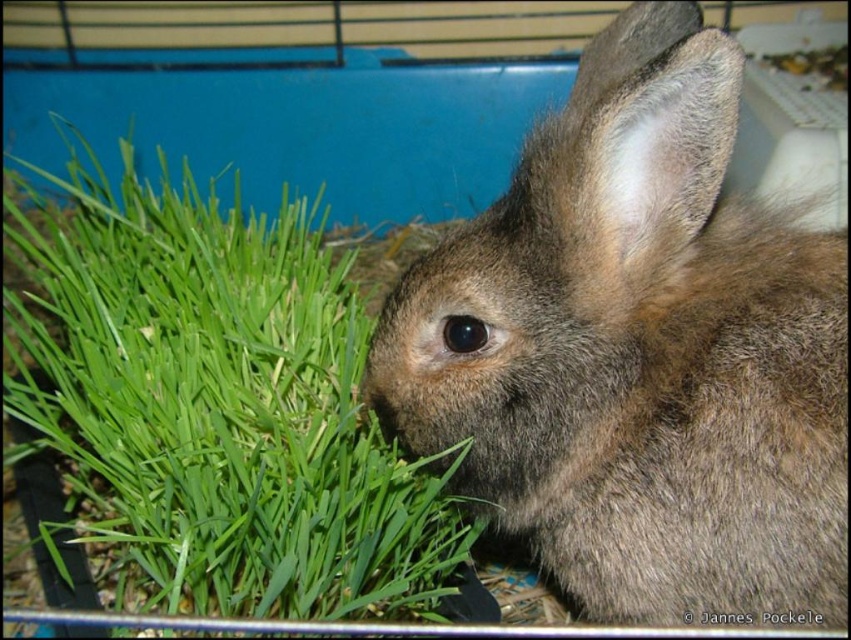
Is brown furry rabbit at center shorter than green leafy grass at left?

Indeed, brown furry rabbit at center has a lesser height compared to green leafy grass at left.

Who is more distant from viewer, (594, 353) or (95, 349)?

Positioned behind is point (95, 349).

Is point (629, 502) positioned in front of point (132, 468)?

Yes.

The height and width of the screenshot is (640, 851). Identify the location of brown furry rabbit at center. (637, 352).